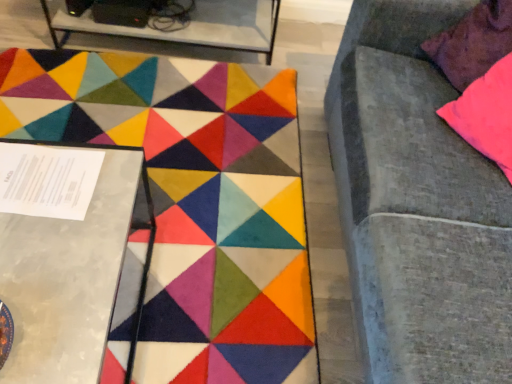
At what (x,y) coordinates should I click in order to perform the action: click on free space above metallic silver table at left, which is the 2th table in back-to-front order (from a real-world perspective). Please return your answer as a coordinate pair (x, y). Looking at the image, I should click on point(49,218).